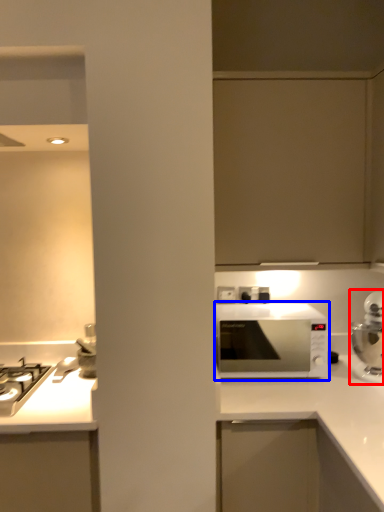
Question: Which object appears farthest to the camera in this image, home appliance (highlighted by a red box) or microwave oven (highlighted by a blue box)?

Choices:
 (A) home appliance
 (B) microwave oven

Answer: (B)